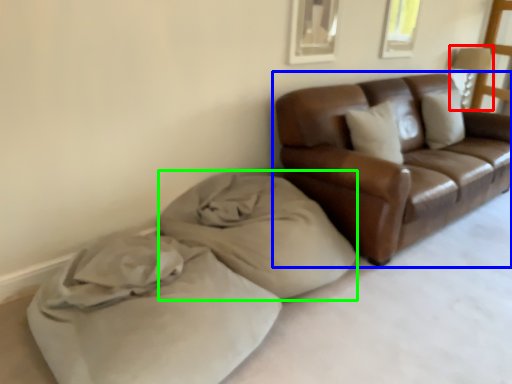
Question: Which object is the closest to the lamp (highlighted by a red box)? Choose among these: studio couch (highlighted by a blue box) or material (highlighted by a green box).

Choices:
 (A) studio couch
 (B) material

Answer: (A)